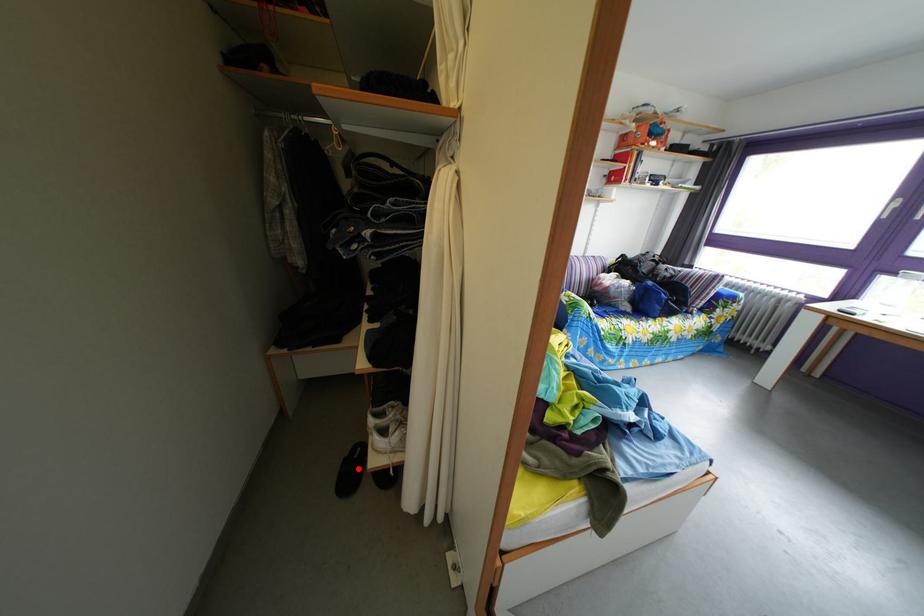
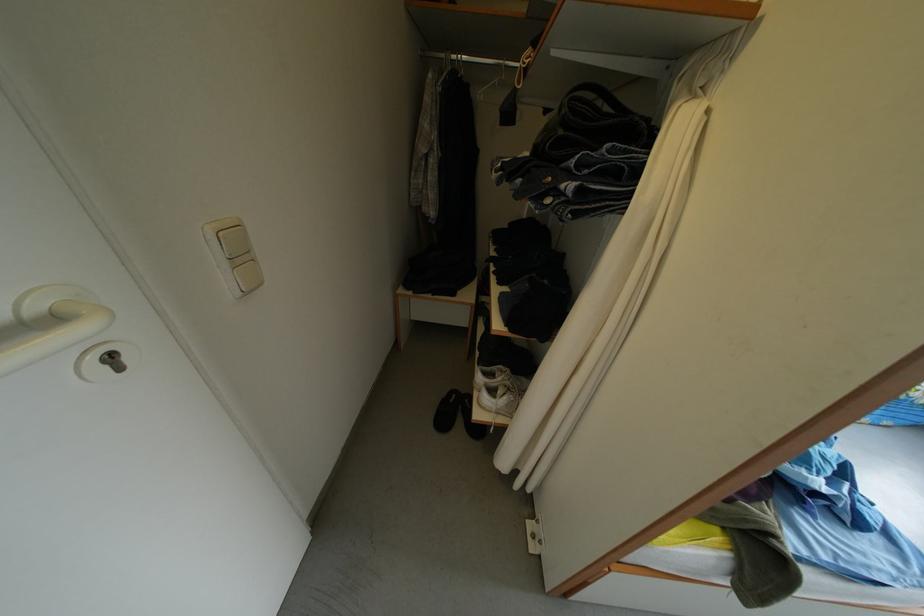
Find the pixel in the second image that matches the highlighted location in the first image.

(456, 411)